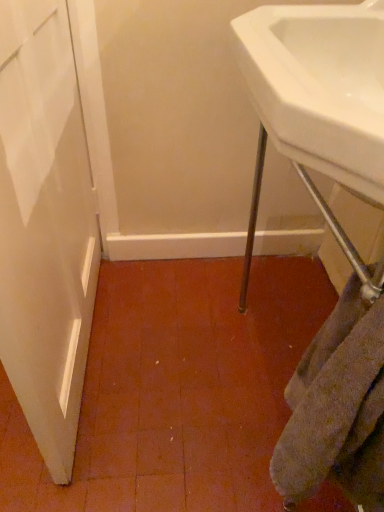
Question: Relative to gray textured towel at lower right, is white glossy sink at upper right in front or behind?

Choices:
 (A) front
 (B) behind

Answer: (A)

Question: From the image's perspective, is white glossy sink at upper right located above or below gray textured towel at lower right?

Choices:
 (A) above
 (B) below

Answer: (A)

Question: Is point (286, 153) closer or farther from the camera than point (296, 477)?

Choices:
 (A) farther
 (B) closer

Answer: (B)

Question: Which is correct: gray textured towel at lower right is inside white glossy sink at upper right, or outside of it?

Choices:
 (A) inside
 (B) outside

Answer: (B)

Question: Is point (306, 476) positioned closer to the camera than point (347, 173)?

Choices:
 (A) closer
 (B) farther

Answer: (B)

Question: Looking at the image, does gray textured towel at lower right seem bigger or smaller compared to white glossy sink at upper right?

Choices:
 (A) big
 (B) small

Answer: (B)

Question: In terms of height, does gray textured towel at lower right look taller or shorter compared to white glossy sink at upper right?

Choices:
 (A) tall
 (B) short

Answer: (A)